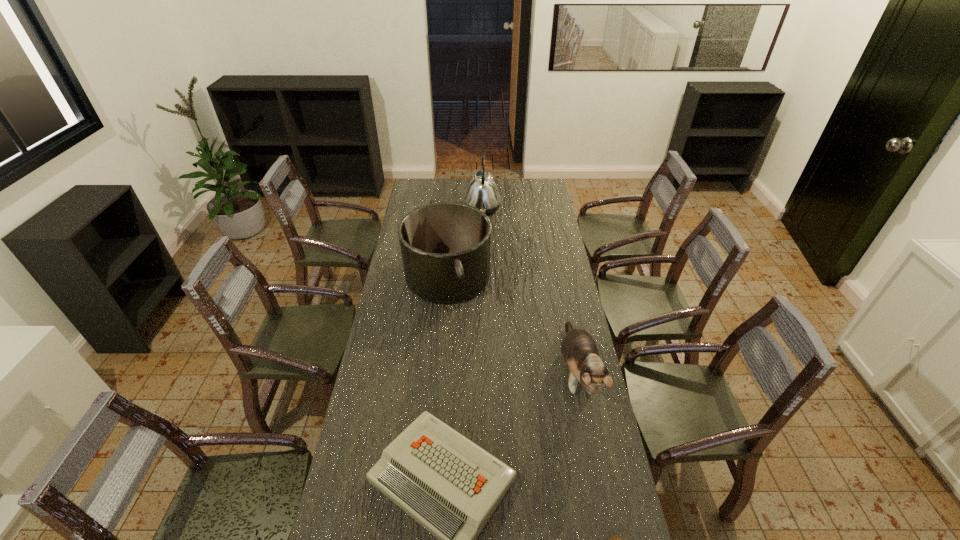
Identify the location of object present at the right edge. (579, 350).

At what (x,y) coordinates should I click in order to perform the action: click on vacant space at the far edge. Please return your answer as a coordinate pair (x, y). Looking at the image, I should click on (519, 179).

Identify the location of free spot at the left edge of the desktop. [405, 312].

Locate an element on the screen. The image size is (960, 540). vacant space at the far left corner is located at coordinates (414, 185).

Where is `blank space at the far right corner of the desktop`? This screenshot has width=960, height=540. blank space at the far right corner of the desktop is located at coordinates (550, 189).

Where is `free space between the cat and the kettle`? free space between the cat and the kettle is located at coordinates (530, 291).

You are a GUI agent. You are given a task and a screenshot of the screen. Output one action in this format:
    pyautogui.click(x=<x>, y=<y>)
    Task: Click on the unoccupied area between the cat and the fourth nearest object
    The height and width of the screenshot is (540, 960).
    Given the screenshot: What is the action you would take?
    pyautogui.click(x=512, y=325)

Find the location of a particular element. This screenshot has width=960, height=540. free spot between the cat and the fourth nearest object is located at coordinates (512, 325).

The width and height of the screenshot is (960, 540). I want to click on vacant point located between the cat and the kettle, so click(530, 291).

Where is `free space between the cat and the second farthest object`? free space between the cat and the second farthest object is located at coordinates (512, 325).